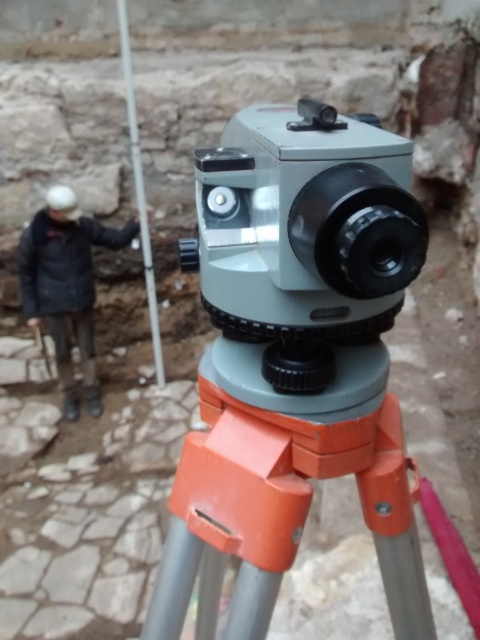
Does dark gray jacket at left lie behind metallic pole at upper left?

Yes.

What do you see at coordinates (66, 285) in the screenshot? Image resolution: width=480 pixels, height=640 pixels. I see `dark gray jacket at left` at bounding box center [66, 285].

The height and width of the screenshot is (640, 480). I want to click on dark gray jacket at left, so click(66, 285).

Does matte gray video camera at center come behind dark gray jacket at left?

No, it is in front of dark gray jacket at left.

The image size is (480, 640). Find the location of `matte gray video camera at center`. matte gray video camera at center is located at coordinates (304, 236).

Is orange plastic tripod at center further to camera compared to metallic pole at upper left?

No, it is in front of metallic pole at upper left.

Does orange plastic tripod at center have a greater height compared to metallic pole at upper left?

Incorrect, orange plastic tripod at center's height is not larger of metallic pole at upper left's.

This screenshot has width=480, height=640. I want to click on orange plastic tripod at center, so click(283, 497).